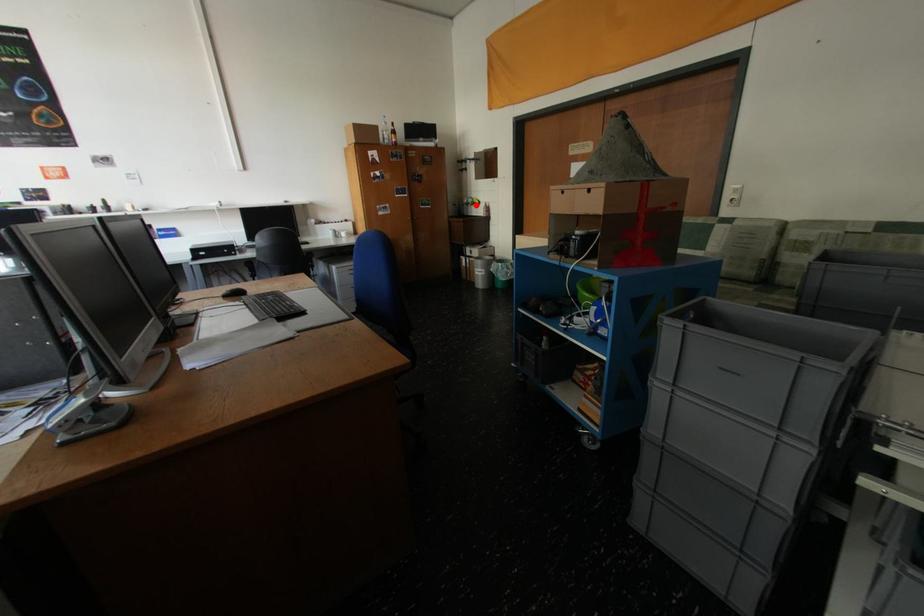
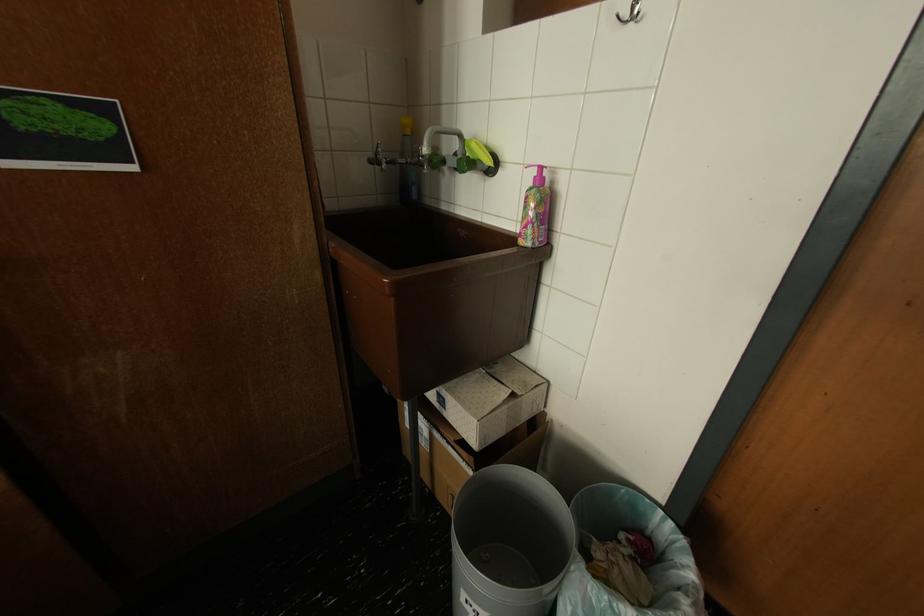
Where in the second image is the point corresponding to the highlighted location from the first image?

(445, 163)